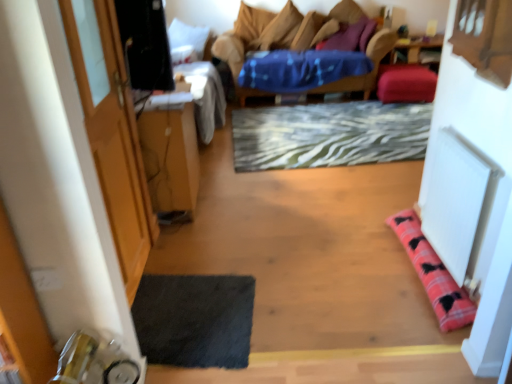
Question: Is velvet blue studio couch at center oriented towards dark gray textured yoga mat at lower left?

Choices:
 (A) no
 (B) yes

Answer: (B)

Question: Is velvet blue studio couch at center looking in the opposite direction of dark gray textured yoga mat at lower left?

Choices:
 (A) no
 (B) yes

Answer: (A)

Question: Is the position of velvet blue studio couch at center more distant than that of dark gray textured yoga mat at lower left?

Choices:
 (A) yes
 (B) no

Answer: (B)

Question: From a real-world perspective, is velvet blue studio couch at center positioned over dark gray textured yoga mat at lower left based on gravity?

Choices:
 (A) no
 (B) yes

Answer: (B)

Question: From a real-world perspective, is velvet blue studio couch at center located beneath dark gray textured yoga mat at lower left?

Choices:
 (A) no
 (B) yes

Answer: (A)

Question: Considering the relative sizes of velvet blue studio couch at center and dark gray textured yoga mat at lower left in the image provided, is velvet blue studio couch at center thinner than dark gray textured yoga mat at lower left?

Choices:
 (A) yes
 (B) no

Answer: (B)

Question: From the image's perspective, is wooden table at left located above wooden armchair at upper center?

Choices:
 (A) yes
 (B) no

Answer: (B)

Question: Considering the relative sizes of wooden table at left and wooden armchair at upper center in the image provided, is wooden table at left smaller than wooden armchair at upper center?

Choices:
 (A) yes
 (B) no

Answer: (A)

Question: Can you confirm if wooden table at left is taller than wooden armchair at upper center?

Choices:
 (A) no
 (B) yes

Answer: (B)

Question: Is wooden table at left outside wooden armchair at upper center?

Choices:
 (A) no
 (B) yes

Answer: (B)

Question: Is the depth of wooden table at left greater than that of wooden armchair at upper center?

Choices:
 (A) no
 (B) yes

Answer: (A)

Question: From a real-world perspective, is wooden table at left below wooden armchair at upper center?

Choices:
 (A) no
 (B) yes

Answer: (B)

Question: Would you say pink plaid pillow at lower right, which is counted as the first pillow, starting from the front, is part of dark gray textured yoga mat at lower left's contents?

Choices:
 (A) no
 (B) yes

Answer: (A)